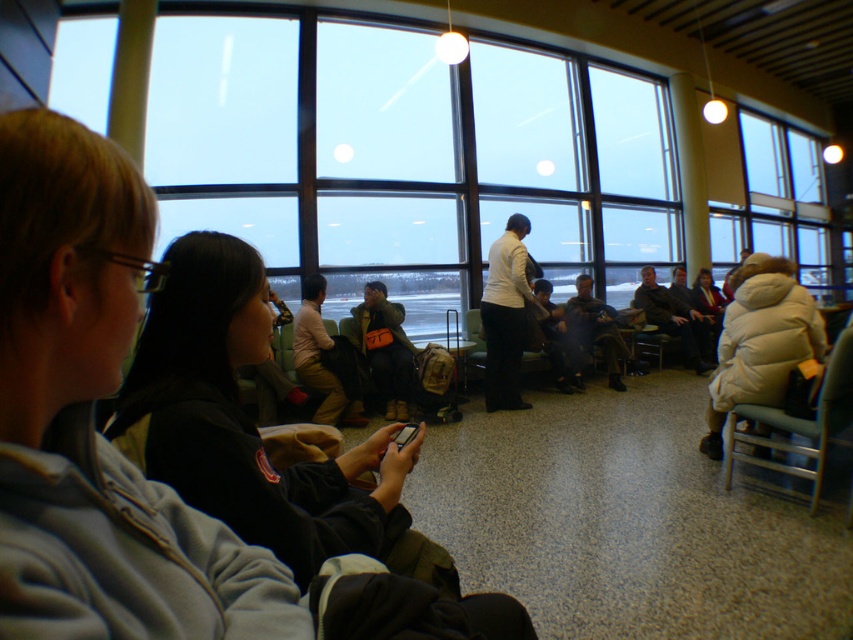
Consider the image. Can you confirm if light beige fabric chair at right is positioned above khaki cotton pants at center?

No, light beige fabric chair at right is not above khaki cotton pants at center.

Consider the image. Who is more forward, (781, 468) or (300, 301)?

Positioned in front is point (781, 468).

Does point (846, 360) lie in front of point (308, 356)?

Yes, point (846, 360) is closer to viewer.

You are a GUI agent. You are given a task and a screenshot of the screen. Output one action in this format:
    pyautogui.click(x=<x>, y=<y>)
    Task: Click on the light beige fabric chair at right
    The width and height of the screenshot is (853, 640).
    Given the screenshot: What is the action you would take?
    pyautogui.click(x=798, y=422)

Is white matte jacket at center shorter than dark gray fabric jacket at center?

No.

From the picture: Does white matte jacket at center have a greater width compared to dark gray fabric jacket at center?

In fact, white matte jacket at center might be narrower than dark gray fabric jacket at center.

Where is `white matte jacket at center`? white matte jacket at center is located at coordinates (505, 316).

Can you confirm if khaki cotton pants at center is positioned above white puffy coat at center?

Actually, khaki cotton pants at center is below white puffy coat at center.

Image resolution: width=853 pixels, height=640 pixels. In order to click on khaki cotton pants at center in this screenshot , I will do `click(318, 358)`.

The width and height of the screenshot is (853, 640). In order to click on khaki cotton pants at center in this screenshot , I will do `click(318, 358)`.